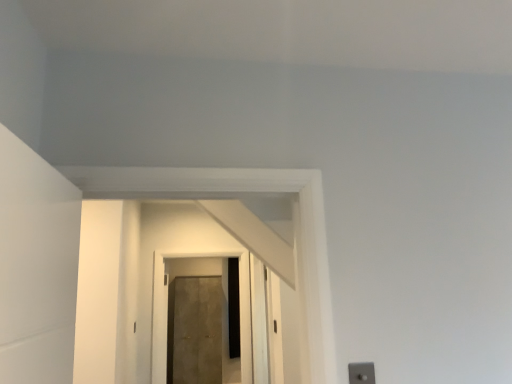
Question: From a real-world perspective, is matte brown door at center, marked as the second door in a back-to-front arrangement, located beneath silver metallic switch at lower right?

Choices:
 (A) no
 (B) yes

Answer: (A)

Question: Can you confirm if matte brown door at center, marked as the second door in a back-to-front arrangement, is taller than silver metallic switch at lower right?

Choices:
 (A) yes
 (B) no

Answer: (A)

Question: Is matte brown door at center, which appears as the first door when viewed from the front, directly adjacent to silver metallic switch at lower right?

Choices:
 (A) no
 (B) yes

Answer: (A)

Question: Considering the relative positions of matte brown door at center, which appears as the first door when viewed from the front, and silver metallic switch at lower right in the image provided, is matte brown door at center, which appears as the first door when viewed from the front, to the right of silver metallic switch at lower right from the viewer's perspective?

Choices:
 (A) no
 (B) yes

Answer: (A)

Question: Is matte brown door at center, which appears as the first door when viewed from the front, positioned before silver metallic switch at lower right?

Choices:
 (A) yes
 (B) no

Answer: (B)

Question: Does point (172, 301) appear closer or farther from the camera than point (360, 377)?

Choices:
 (A) farther
 (B) closer

Answer: (A)

Question: From the image's perspective, is matte concrete door at center, placed as the second door when sorted from front to back, located above or below silver metallic switch at lower right?

Choices:
 (A) below
 (B) above

Answer: (A)

Question: Based on their sizes in the image, would you say matte concrete door at center, placed as the second door when sorted from front to back, is bigger or smaller than silver metallic switch at lower right?

Choices:
 (A) big
 (B) small

Answer: (A)

Question: Considering their positions, is matte concrete door at center, the 1th door from the back, located in front of or behind silver metallic switch at lower right?

Choices:
 (A) behind
 (B) front

Answer: (A)

Question: From a real-world perspective, relative to matte concrete door at center, placed as the second door when sorted from front to back, is matte brown door at center, which appears as the first door when viewed from the front, vertically above or below?

Choices:
 (A) above
 (B) below

Answer: (A)

Question: From the image's perspective, is matte brown door at center, which appears as the first door when viewed from the front, positioned above or below matte concrete door at center, placed as the second door when sorted from front to back?

Choices:
 (A) below
 (B) above

Answer: (B)

Question: From their relative heights in the image, would you say matte brown door at center, which appears as the first door when viewed from the front, is taller or shorter than matte concrete door at center, the 1th door from the back?

Choices:
 (A) short
 (B) tall

Answer: (A)

Question: Does point pyautogui.click(x=233, y=253) appear closer or farther from the camera than point pyautogui.click(x=204, y=362)?

Choices:
 (A) farther
 (B) closer

Answer: (B)

Question: In terms of width, does matte concrete door at center, the 1th door from the back, look wider or thinner when compared to matte brown door at center, marked as the second door in a back-to-front arrangement?

Choices:
 (A) thin
 (B) wide

Answer: (B)

Question: Choose the correct answer: Is matte concrete door at center, the 1th door from the back, inside matte brown door at center, marked as the second door in a back-to-front arrangement, or outside it?

Choices:
 (A) inside
 (B) outside

Answer: (B)